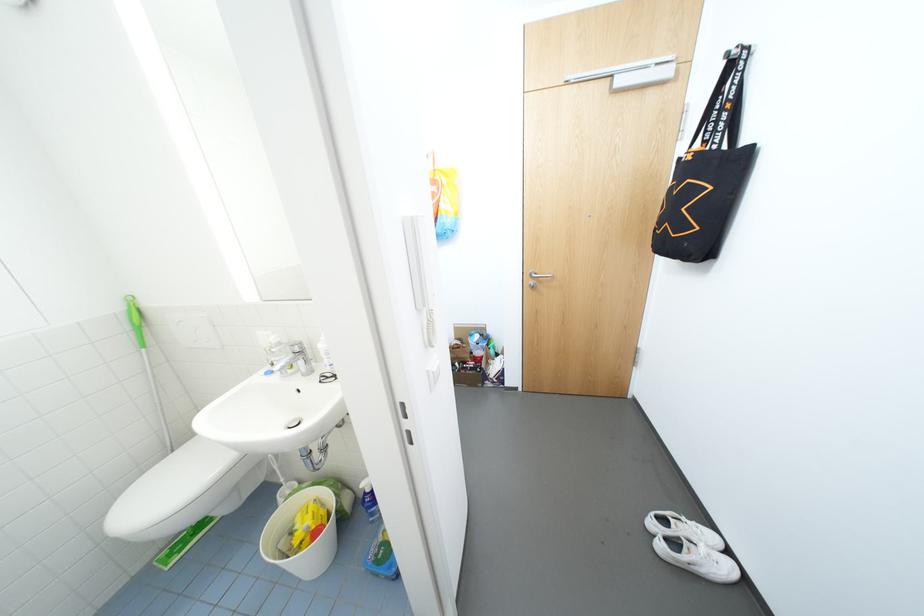
The height and width of the screenshot is (616, 924). What are the coordinates of `wall flush button` in the screenshot? It's located at point(196,331).